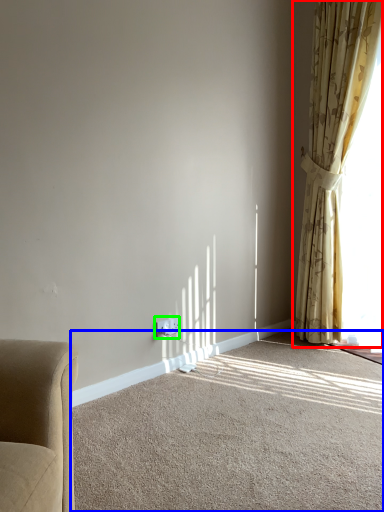
Question: Considering the real-world distances, which object is farthest from curtain (highlighted by a red box)? plain (highlighted by a blue box) or electric outlet (highlighted by a green box)?

Choices:
 (A) plain
 (B) electric outlet

Answer: (B)